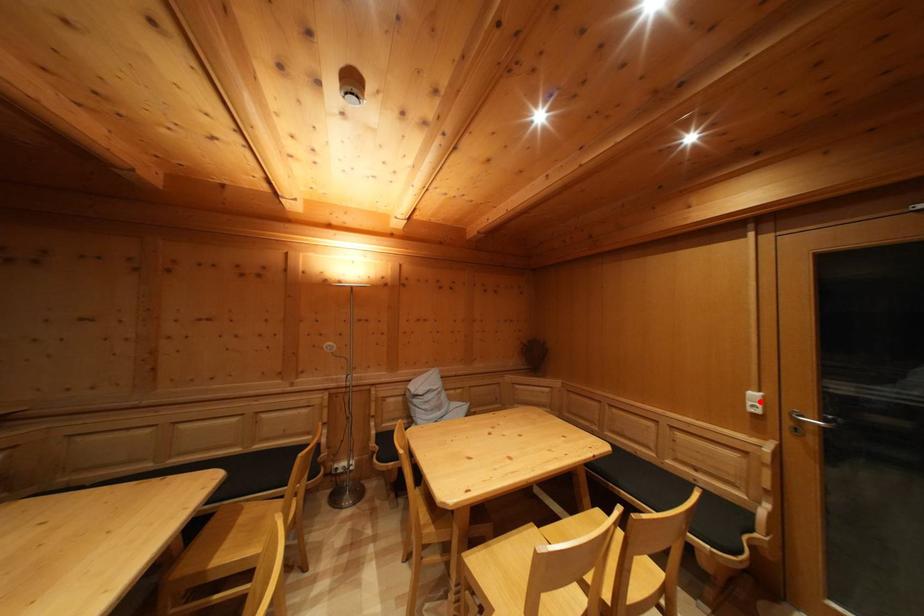
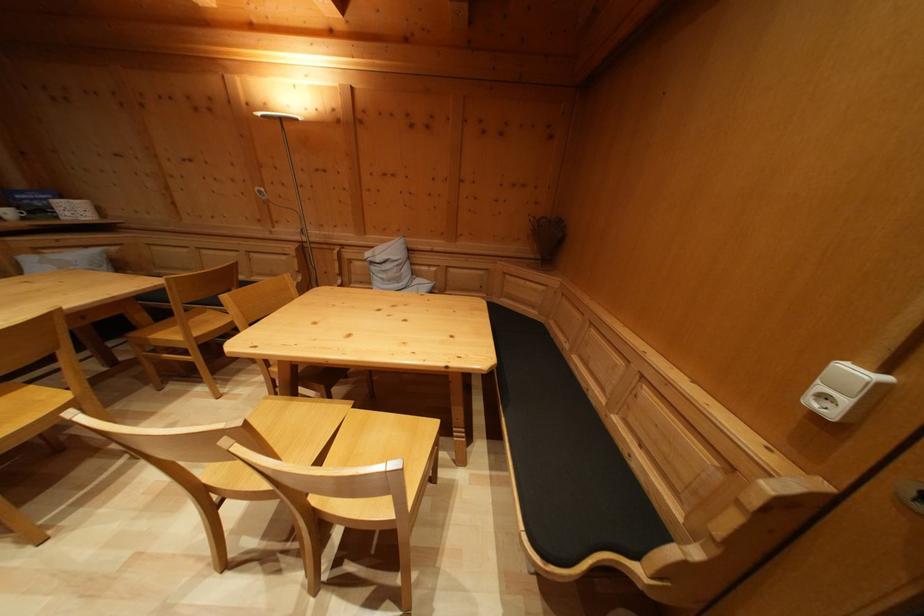
Locate, in the second image, the point that corresponds to the highlighted location in the first image.

(859, 379)